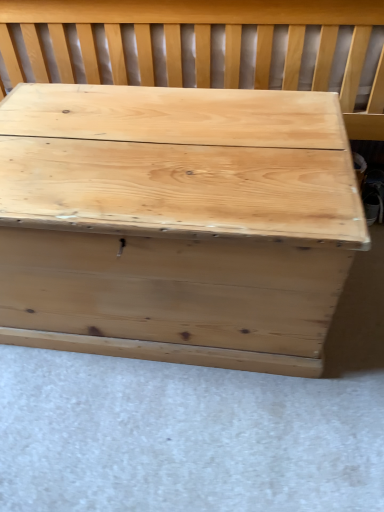
This screenshot has height=512, width=384. Identify the location of natural wood chest at center. (202, 44).

Describe the element at coordinates (202, 44) in the screenshot. I see `natural wood chest at center` at that location.

This screenshot has height=512, width=384. Describe the element at coordinates (176, 222) in the screenshot. I see `natural wood trunk at center` at that location.

Locate an element on the screen. This screenshot has height=512, width=384. natural wood trunk at center is located at coordinates (176, 222).

Where is `natural wood chest at center`? The width and height of the screenshot is (384, 512). natural wood chest at center is located at coordinates (202, 44).

Which is more to the left, natural wood chest at center or natural wood trunk at center?

natural wood trunk at center is more to the left.

Is the depth of natural wood chest at center less than that of natural wood trunk at center?

No, the depth of natural wood chest at center is greater than that of natural wood trunk at center.

Which point is more distant from viewer, (316, 55) or (187, 273)?

Point (316, 55)

From the image's perspective, is natural wood chest at center over natural wood trunk at center?

Indeed, from the image's perspective, natural wood chest at center is shown above natural wood trunk at center.

From a real-world perspective, is natural wood chest at center under natural wood trunk at center?

No, from a real-world perspective, natural wood chest at center is not beneath natural wood trunk at center.

Looking at their sizes, would you say natural wood chest at center is wider or thinner than natural wood trunk at center?

Considering their sizes, natural wood chest at center looks broader than natural wood trunk at center.

Is natural wood chest at center shorter than natural wood trunk at center?

Incorrect, the height of natural wood chest at center does not fall short of that of natural wood trunk at center.

In terms of size, does natural wood chest at center appear bigger or smaller than natural wood trunk at center?

In the image, natural wood chest at center appears to be larger than natural wood trunk at center.

Is natural wood chest at center positioned beyond the bounds of natural wood trunk at center?

That's correct, natural wood chest at center is outside of natural wood trunk at center.

Does natural wood chest at center touch natural wood trunk at center?

No.

Looking at this image, is natural wood chest at center aimed at natural wood trunk at center?

Yes, natural wood chest at center is oriented towards natural wood trunk at center.

How different are the orientations of natural wood chest at center and natural wood trunk at center in degrees?

0.000521 degrees separate the facing orientations of natural wood chest at center and natural wood trunk at center.

Where is `table on the left of natural wood chest at center`? The image size is (384, 512). table on the left of natural wood chest at center is located at coordinates (176, 222).

Does natural wood trunk at center appear on the right side of natural wood chest at center?

No, natural wood trunk at center is not to the right of natural wood chest at center.

Which object is closer to the camera, natural wood trunk at center or natural wood chest at center?

natural wood trunk at center is in front.

Considering the points (43, 161) and (87, 1), which point is behind, point (43, 161) or point (87, 1)?

The point (87, 1) is more distant.

From the image's perspective, is natural wood trunk at center located above natural wood chest at center?

Incorrect, from the image's perspective, natural wood trunk at center is lower than natural wood chest at center.

Based on the photo, from a real-world perspective, is natural wood trunk at center physically above natural wood chest at center?

No, from a real-world perspective, natural wood trunk at center is not over natural wood chest at center

In the scene shown: Which of these two, natural wood trunk at center or natural wood chest at center, is thinner?

natural wood trunk at center.

Considering the relative sizes of natural wood trunk at center and natural wood chest at center in the image provided, is natural wood trunk at center taller than natural wood chest at center?

No.

Is natural wood trunk at center bigger or smaller than natural wood chest at center?

natural wood trunk at center is smaller than natural wood chest at center.

Is natural wood trunk at center inside or outside of natural wood chest at center?

natural wood trunk at center is not enclosed by natural wood chest at center.

Is natural wood trunk at center in contact with natural wood chest at center?

natural wood trunk at center and natural wood chest at center are clearly separated.

Is natural wood trunk at center facing towards natural wood chest at center?

No, natural wood trunk at center is not facing towards natural wood chest at center.

Can you tell me how much natural wood trunk at center and natural wood chest at center differ in facing direction?

The angle between the facing direction of natural wood trunk at center and the facing direction of natural wood chest at center is 0.000521 degrees.

How far apart are natural wood trunk at center and natural wood chest at center?

A distance of 17.25 inches exists between natural wood trunk at center and natural wood chest at center.

I want to click on table that appears below the natural wood chest at center (from the image's perspective), so click(x=176, y=222).

Locate an element on the screen. church bench lying behind the natural wood trunk at center is located at coordinates (202, 44).

This screenshot has width=384, height=512. Identify the location of table below the natural wood chest at center (from the image's perspective). (176, 222).